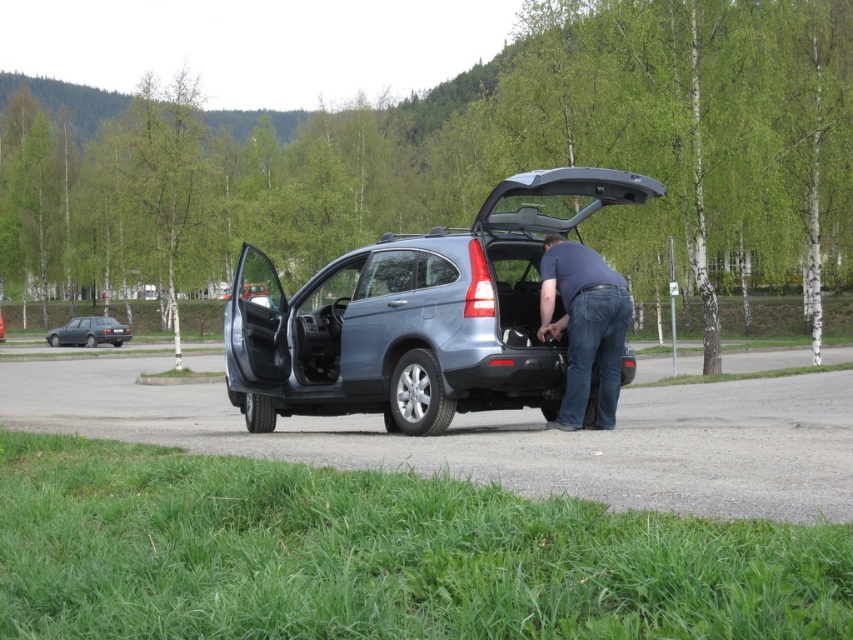
You are standing at the center of the image and want to walk to the dark gray metallic sedan at left. Which direction should you move to reach it?

The dark gray metallic sedan at left is located at point coordinates, so you should move to the left to reach it.

You are a parking attendant who needs to fit both the dark gray metallic sedan at left and the satin silver suv at center into a parking space that is 2.5 meters wide. Based on their widths, which vehicle will require more careful maneuvering to avoid touching the adjacent vehicles?

The satin silver suv at center has a greater width than the dark gray metallic sedan at left, so it will require more careful maneuvering to avoid touching the adjacent vehicles.

You are a delivery person trying to park your van between the metallic blue suv at center and the satin silver suv at center. Based on the scene, which SUV should you park closer to in order to fit your van?

The metallic blue suv at center is shorter than the satin silver suv at center, so you should park closer to the metallic blue suv at center to ensure there is enough vertical space for your van.